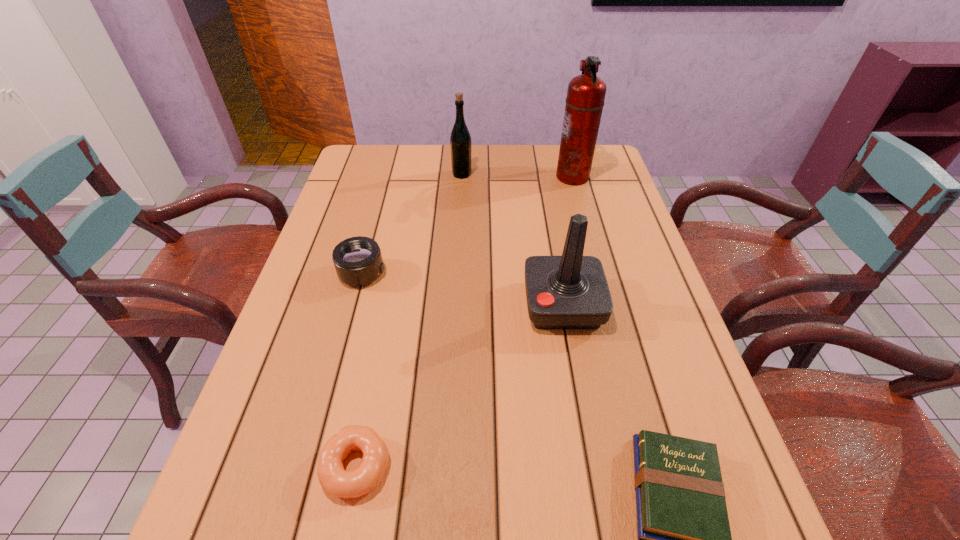
In order to click on vacant region at the left edge of the desktop in this screenshot , I will do `click(294, 474)`.

The height and width of the screenshot is (540, 960). In the image, there is a desktop. Identify the location of blank space at the right edge. (635, 258).

Identify the location of vacant space at the far left corner. The image size is (960, 540). (385, 177).

Identify the location of vacant area that lies between the telephoto lens and the beer bottle. 412,224.

You are a GUI agent. You are given a task and a screenshot of the screen. Output one action in this format:
    pyautogui.click(x=<x>, y=<y>)
    Task: Click on the vacant area that lies between the third shortest object and the fourth object from right to left
    
    Given the screenshot: What is the action you would take?
    pyautogui.click(x=412, y=224)

Locate an element on the screen. Image resolution: width=960 pixels, height=540 pixels. empty space between the doughnut and the joystick is located at coordinates (460, 386).

Identify the location of free spot between the joystick and the doughnut. The image size is (960, 540). (460, 386).

At what (x,y) coordinates should I click in order to perform the action: click on object identified as the fourth closest to the book. Please return your answer as a coordinate pair (x, y). Image resolution: width=960 pixels, height=540 pixels. Looking at the image, I should click on (586, 93).

Select which object is the closest to the joystick. Please provide its 2D coordinates. Your answer should be formatted as a tuple, i.e. [(x, y)], where the tuple contains the x and y coordinates of a point satisfying the conditions above.

[(684, 539)]

Where is `vacant space that satisfies the following two spatial constraints: 1. on the back side of the third object from left to right; 2. on the right side of the doughnut`? The image size is (960, 540). vacant space that satisfies the following two spatial constraints: 1. on the back side of the third object from left to right; 2. on the right side of the doughnut is located at coordinates (414, 174).